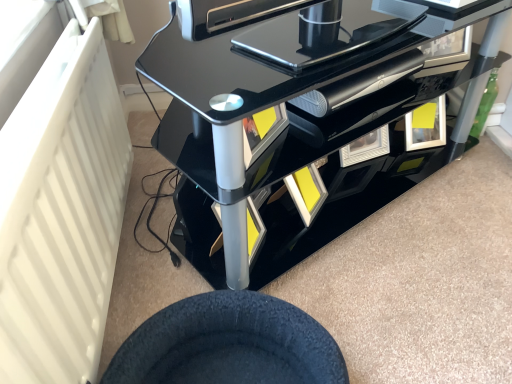
Question: In terms of height, does black fuzzy wheel at lower center look taller or shorter compared to glossy black entertainment unit at center?

Choices:
 (A) tall
 (B) short

Answer: (B)

Question: Considering the positions of point (225, 365) and point (254, 99), is point (225, 365) closer or farther from the camera than point (254, 99)?

Choices:
 (A) closer
 (B) farther

Answer: (A)

Question: Is black fuzzy wheel at lower center wider or thinner than glossy black entertainment unit at center?

Choices:
 (A) wide
 (B) thin

Answer: (A)

Question: From a real-world perspective, is glossy black entertainment unit at center physically located above or below black fuzzy wheel at lower center?

Choices:
 (A) below
 (B) above

Answer: (B)

Question: From the image's perspective, is glossy black entertainment unit at center above or below black fuzzy wheel at lower center?

Choices:
 (A) above
 (B) below

Answer: (A)

Question: Is point (301, 72) positioned closer to the camera than point (205, 294)?

Choices:
 (A) farther
 (B) closer

Answer: (A)

Question: Based on their sizes in the image, would you say glossy black entertainment unit at center is bigger or smaller than black fuzzy wheel at lower center?

Choices:
 (A) small
 (B) big

Answer: (B)